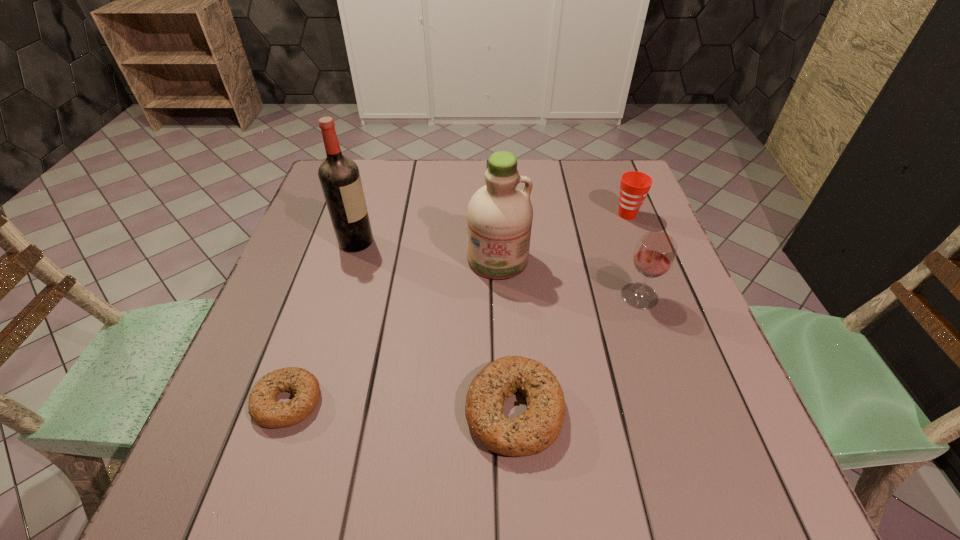
Image resolution: width=960 pixels, height=540 pixels. Identify the location of vacant place for an extra bagel on the right. (749, 420).